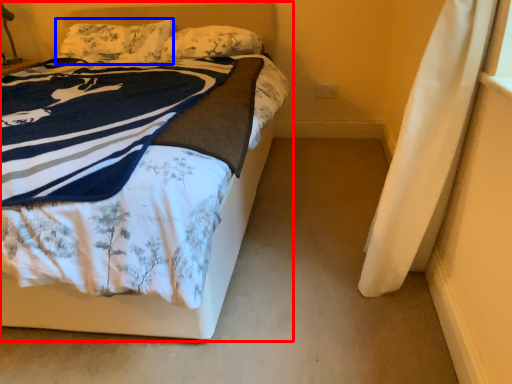
Question: Which of the following is the farthest to the observer, bed (highlighted by a red box) or pillow (highlighted by a blue box)?

Choices:
 (A) bed
 (B) pillow

Answer: (B)